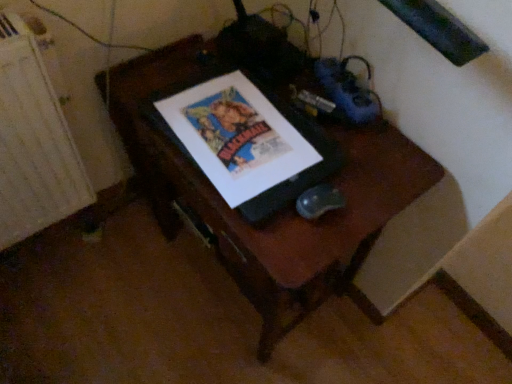
Question: Considering the relative sizes of white textured radiator at left and wooden desk at center in the image provided, is white textured radiator at left taller than wooden desk at center?

Choices:
 (A) no
 (B) yes

Answer: (A)

Question: Could you tell me if white textured radiator at left is facing wooden desk at center?

Choices:
 (A) no
 (B) yes

Answer: (A)

Question: Does white textured radiator at left have a lesser height compared to wooden desk at center?

Choices:
 (A) no
 (B) yes

Answer: (B)

Question: Is white textured radiator at left located outside wooden desk at center?

Choices:
 (A) yes
 (B) no

Answer: (A)

Question: Is white textured radiator at left positioned before wooden desk at center?

Choices:
 (A) yes
 (B) no

Answer: (B)

Question: Is wooden desk at center located within white textured radiator at left?

Choices:
 (A) yes
 (B) no

Answer: (B)

Question: Is wooden desk at center positioned in front of white textured radiator at left?

Choices:
 (A) yes
 (B) no

Answer: (A)

Question: Is wooden desk at center facing away from white textured radiator at left?

Choices:
 (A) yes
 (B) no

Answer: (B)

Question: Considering the relative sizes of wooden desk at center and white textured radiator at left in the image provided, is wooden desk at center shorter than white textured radiator at left?

Choices:
 (A) no
 (B) yes

Answer: (A)

Question: Is wooden desk at center completely or partially outside of white textured radiator at left?

Choices:
 (A) yes
 (B) no

Answer: (A)

Question: From a real-world perspective, does wooden desk at center stand above white textured radiator at left?

Choices:
 (A) no
 (B) yes

Answer: (A)

Question: Would you consider wooden desk at center to be distant from white textured radiator at left?

Choices:
 (A) yes
 (B) no

Answer: (B)

Question: Is matte paper poster at center at the left side of white textured radiator at left?

Choices:
 (A) no
 (B) yes

Answer: (A)